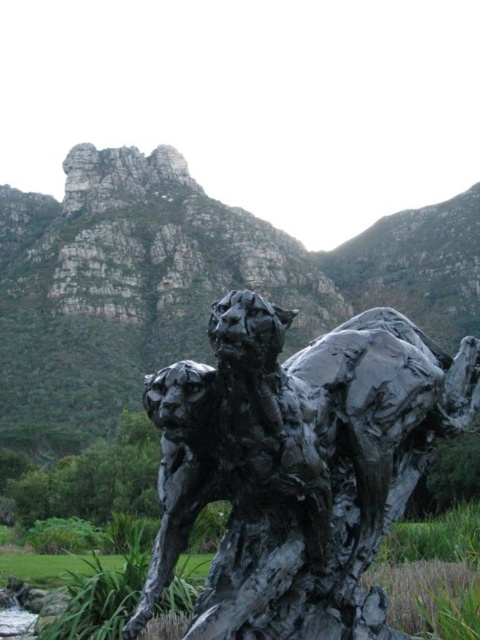
You are standing in front of the metallic leopard sculpture and notice two points marked on it. The points are labeled as point 1 at coordinates (x=319, y=513) and point 2 at (x=101, y=333). If you were to touch both points, which one would feel closer to your hand?

Point 1 at coordinates (x=319, y=513) is closer to the viewer than point 2 at (x=101, y=333), so touching point 1 would feel closer to your hand.

You are an architect designing a new park and want to place a bench between the black textured sculpture at center and the rugged stone mountain at upper center. Which object should the bench be closer to if you want it to be closer to the taller object?

The rugged stone mountain at upper center is taller than the black textured sculpture at center, so the bench should be placed closer to the rugged stone mountain at upper center to be near the taller object.

You are an art student analyzing the composition of the scene. The black textured sculpture at center and rugged stone mountain at upper center are both central to the image. Which object is positioned to the right side of the other?

The black textured sculpture at center is to the right of rugged stone mountain at upper center.